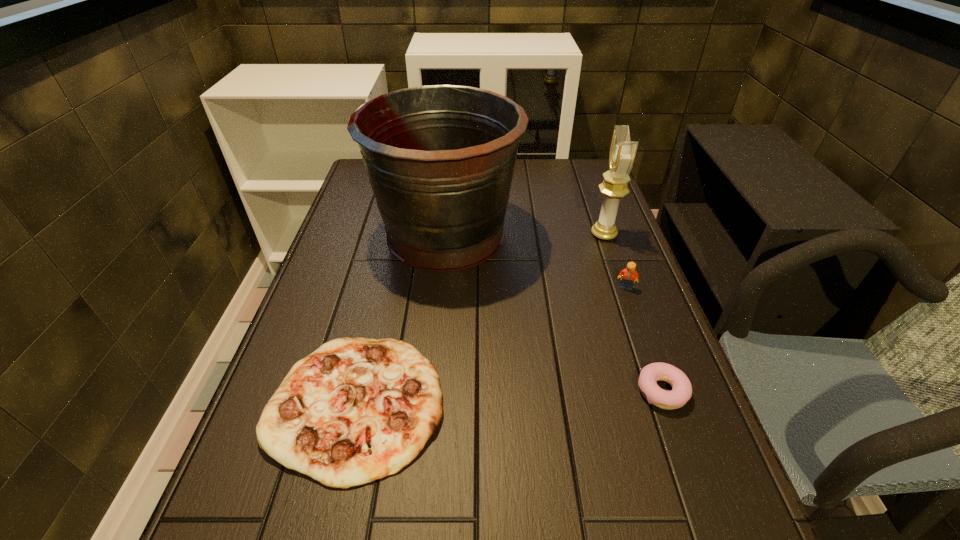
Where is `vacant space at the far left corner of the desktop`? vacant space at the far left corner of the desktop is located at coordinates (353, 185).

Identify the location of free region at the far right corner. This screenshot has width=960, height=540. (565, 184).

I want to click on free space between the bucket and the Lego, so click(536, 261).

What are the coordinates of `blank region between the doughnut and the fourth shortest object` in the screenshot? It's located at (633, 313).

You are a GUI agent. You are given a task and a screenshot of the screen. Output one action in this format:
    pyautogui.click(x=<x>, y=<y>)
    Task: Click on the vacant point located between the bucket and the pizza
    The image size is (960, 540).
    Given the screenshot: What is the action you would take?
    pyautogui.click(x=401, y=319)

At what (x,y) coordinates should I click in order to perform the action: click on vacant point located between the bucket and the Lego. Please return your answer as a coordinate pair (x, y). The image size is (960, 540). Looking at the image, I should click on (536, 261).

At what (x,y) coordinates should I click in order to perform the action: click on free space between the pizza and the bucket. Please return your answer as a coordinate pair (x, y). The width and height of the screenshot is (960, 540). Looking at the image, I should click on (401, 319).

This screenshot has height=540, width=960. Find the location of `vacant point located between the doughnut and the third tallest object`. vacant point located between the doughnut and the third tallest object is located at coordinates (643, 340).

You are a GUI agent. You are given a task and a screenshot of the screen. Output one action in this format:
    pyautogui.click(x=<x>, y=<y>)
    Task: Click on the vacant space that's between the doughnut and the second tallest object
    This screenshot has width=960, height=540.
    Given the screenshot: What is the action you would take?
    coord(633,313)

You are a GUI agent. You are given a task and a screenshot of the screen. Output one action in this format:
    pyautogui.click(x=<x>, y=<y>)
    Task: Click on the empty space that is in between the pizza and the doughnut
    This screenshot has width=960, height=540.
    Given the screenshot: What is the action you would take?
    pyautogui.click(x=509, y=397)